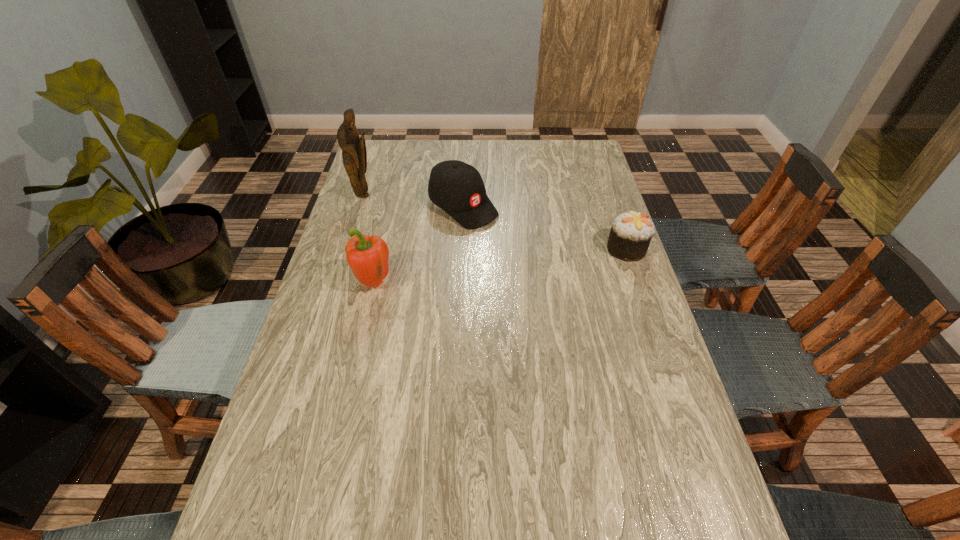
Image resolution: width=960 pixels, height=540 pixels. I want to click on the second tallest object, so click(x=368, y=257).

The height and width of the screenshot is (540, 960). In order to click on the nearest object in this screenshot , I will do `click(368, 257)`.

I want to click on the rightmost object, so click(x=631, y=232).

Find the location of `cupcake`. cupcake is located at coordinates (631, 232).

The image size is (960, 540). I want to click on figurine, so click(x=354, y=154).

This screenshot has height=540, width=960. I want to click on the leftmost object, so click(x=354, y=154).

In order to click on baseball cap in this screenshot , I will do `click(456, 187)`.

Locate an element on the screen. free spot located 0.140m on the back of the pepper is located at coordinates point(384,238).

Find the location of `vacant region located 0.090m on the back of the second nearest object`. vacant region located 0.090m on the back of the second nearest object is located at coordinates (616, 218).

I want to click on free region located 0.130m on the front-facing side of the leftmost object, so click(x=400, y=214).